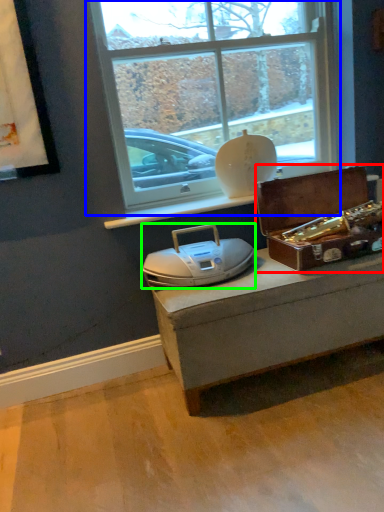
Question: Considering the real-world distances, which object is closest to box (highlighted by a red box)? window (highlighted by a blue box) or stereo (highlighted by a green box).

Choices:
 (A) window
 (B) stereo

Answer: (B)